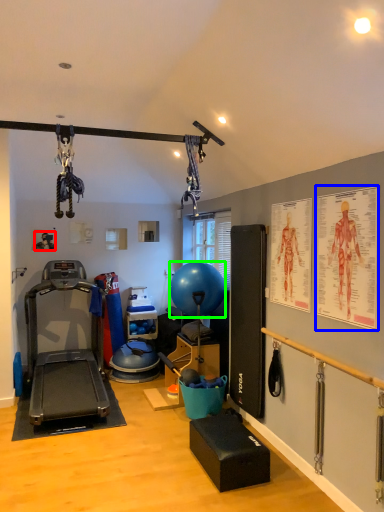
Question: Which is farther away from person (highlighted by a red box)? poster page (highlighted by a blue box) or balloon (highlighted by a green box)?

Choices:
 (A) poster page
 (B) balloon

Answer: (A)